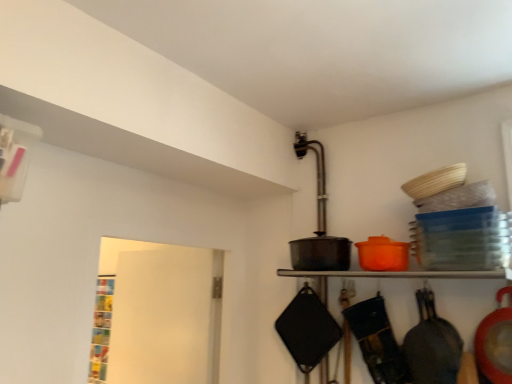
Question: Considering the relative sizes of matte black frying pan at right, which is the first frying pan from right to left, and black matte frying pan at lower right, marked as the second frying pan in a right-to-left arrangement, in the image provided, is matte black frying pan at right, which is the first frying pan from right to left, smaller than black matte frying pan at lower right, marked as the second frying pan in a right-to-left arrangement,?

Choices:
 (A) yes
 (B) no

Answer: (A)

Question: Is matte black frying pan at right, which is the first frying pan from right to left, not within black matte frying pan at lower right, marked as the second frying pan in a right-to-left arrangement?

Choices:
 (A) yes
 (B) no

Answer: (A)

Question: From a real-world perspective, is matte black frying pan at right, acting as the second frying pan starting from the left, beneath black matte frying pan at lower right, marked as the second frying pan in a right-to-left arrangement?

Choices:
 (A) yes
 (B) no

Answer: (B)

Question: From the image's perspective, would you say matte black frying pan at right, which is the first frying pan from right to left, is positioned over black matte frying pan at lower right, placed as the 1th frying pan when sorted from left to right?

Choices:
 (A) no
 (B) yes

Answer: (B)

Question: Can you confirm if matte black frying pan at right, which is the first frying pan from right to left, is taller than black matte frying pan at lower right, placed as the 1th frying pan when sorted from left to right?

Choices:
 (A) no
 (B) yes

Answer: (A)

Question: Relative to white matte door at left, is matte black frying pan at right, acting as the second frying pan starting from the left, in front or behind?

Choices:
 (A) behind
 (B) front

Answer: (B)

Question: In terms of height, does matte black frying pan at right, acting as the second frying pan starting from the left, look taller or shorter compared to white matte door at left?

Choices:
 (A) tall
 (B) short

Answer: (B)

Question: Would you say matte black frying pan at right, which is the first frying pan from right to left, is inside or outside white matte door at left?

Choices:
 (A) inside
 (B) outside

Answer: (B)

Question: Is matte black frying pan at right, acting as the second frying pan starting from the left, to the left or to the right of white matte door at left in the image?

Choices:
 (A) right
 (B) left

Answer: (A)

Question: Visually, is matte black pot at center positioned to the left or to the right of white matte door at left?

Choices:
 (A) left
 (B) right

Answer: (B)

Question: Would you say matte black pot at center is inside or outside white matte door at left?

Choices:
 (A) outside
 (B) inside

Answer: (A)

Question: Considering the positions of matte black pot at center and white matte door at left in the image, is matte black pot at center bigger or smaller than white matte door at left?

Choices:
 (A) big
 (B) small

Answer: (B)

Question: Looking at their shapes, would you say matte black pot at center is wider or thinner than white matte door at left?

Choices:
 (A) wide
 (B) thin

Answer: (A)

Question: From a real-world perspective, is matte black pot at center positioned above or below matte black frying pan at right, acting as the second frying pan starting from the left?

Choices:
 (A) below
 (B) above

Answer: (B)

Question: From their relative heights in the image, would you say matte black pot at center is taller or shorter than matte black frying pan at right, which is the first frying pan from right to left?

Choices:
 (A) tall
 (B) short

Answer: (B)